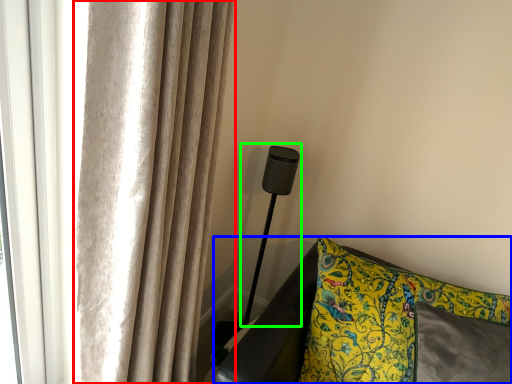
Question: Estimate the real-world distances between objects in this image. Which object is farther from curtain (highlighted by a red box), furniture (highlighted by a blue box) or table lamp (highlighted by a green box)?

Choices:
 (A) furniture
 (B) table lamp

Answer: (B)